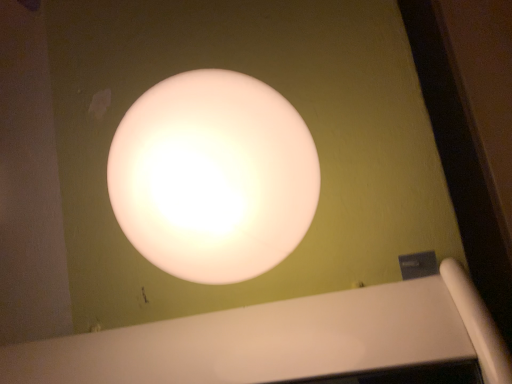
This screenshot has width=512, height=384. I want to click on matte white sphere at center, so click(213, 176).

The image size is (512, 384). What do you see at coordinates (213, 176) in the screenshot?
I see `matte white sphere at center` at bounding box center [213, 176].

At what (x,y) coordinates should I click in order to perform the action: click on matte white sphere at center. Please return your answer as a coordinate pair (x, y). This screenshot has height=384, width=512. Looking at the image, I should click on (213, 176).